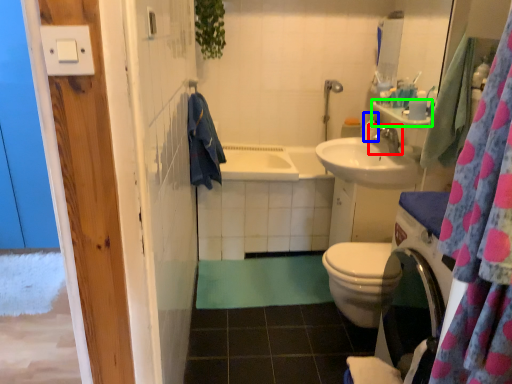
Question: Based on their relative distances, which object is nearer to tap (highlighted by a red box)? Choose from toiletry (highlighted by a blue box) and counter top (highlighted by a green box).

Choices:
 (A) toiletry
 (B) counter top

Answer: (A)